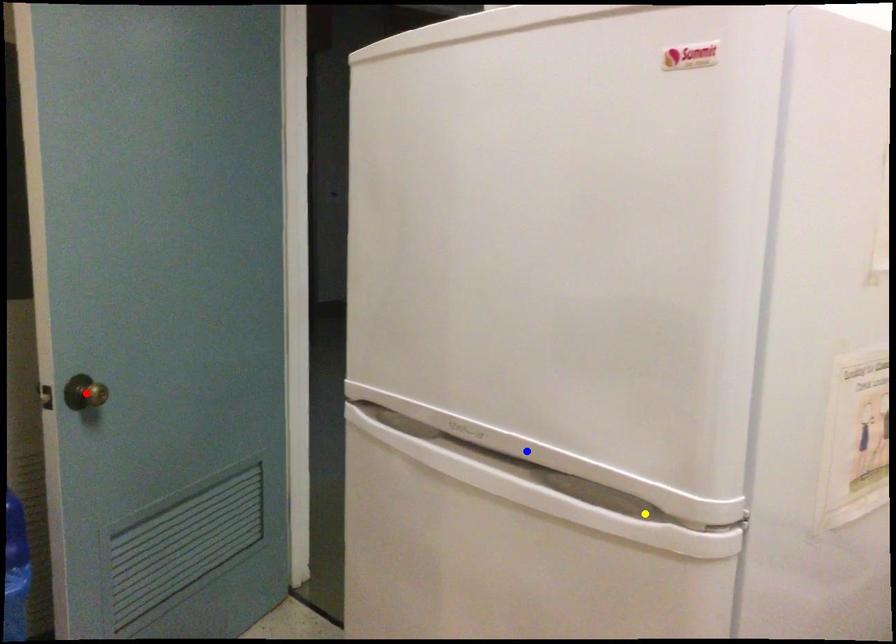
Order these from farthest to nearest:
1. yellow point
2. blue point
3. red point

1. red point
2. blue point
3. yellow point